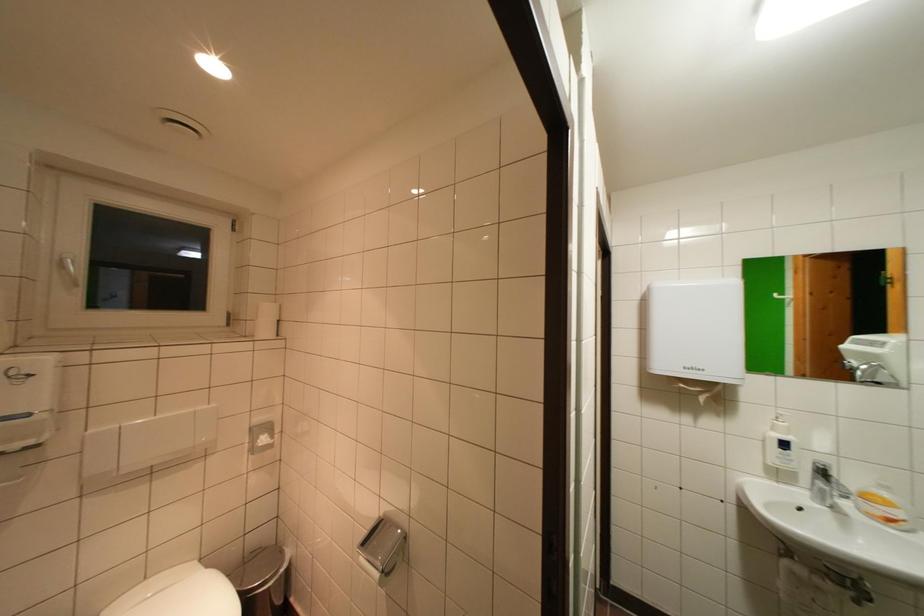
Where is `soap dispenser pump`? soap dispenser pump is located at coordinates (781, 418).